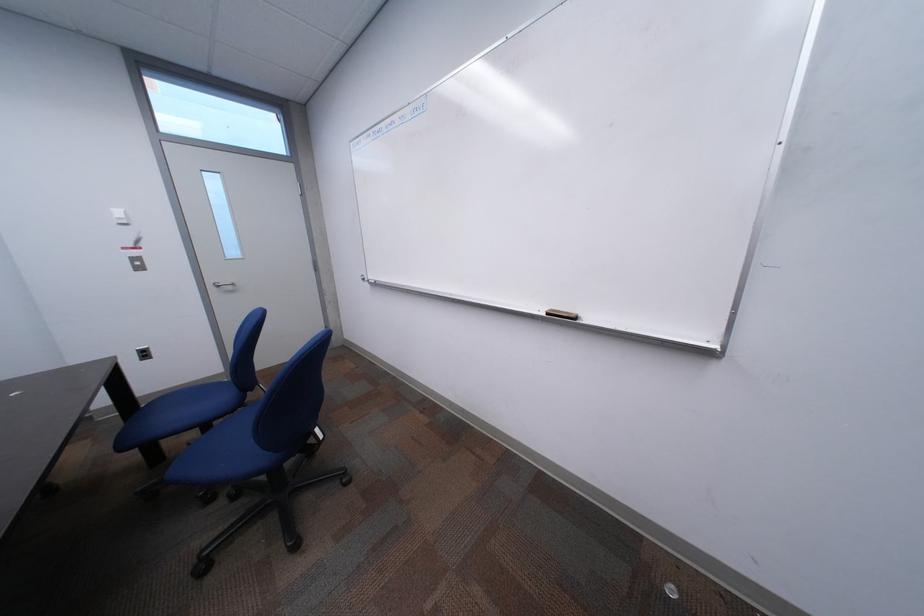
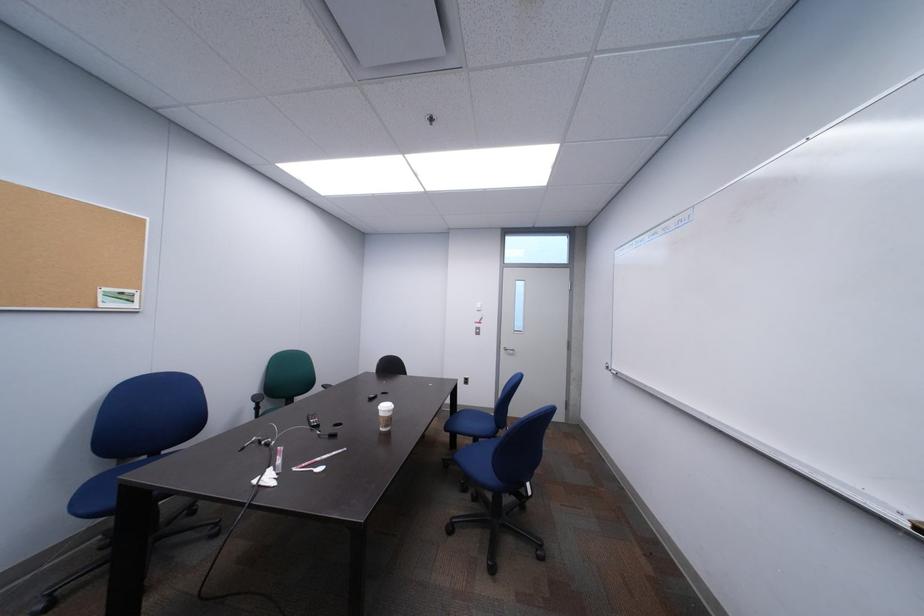
Question: How did the camera likely rotate?

Choices:
 (A) Left
 (B) Right
 (C) Up
 (D) Down

Answer: (A)